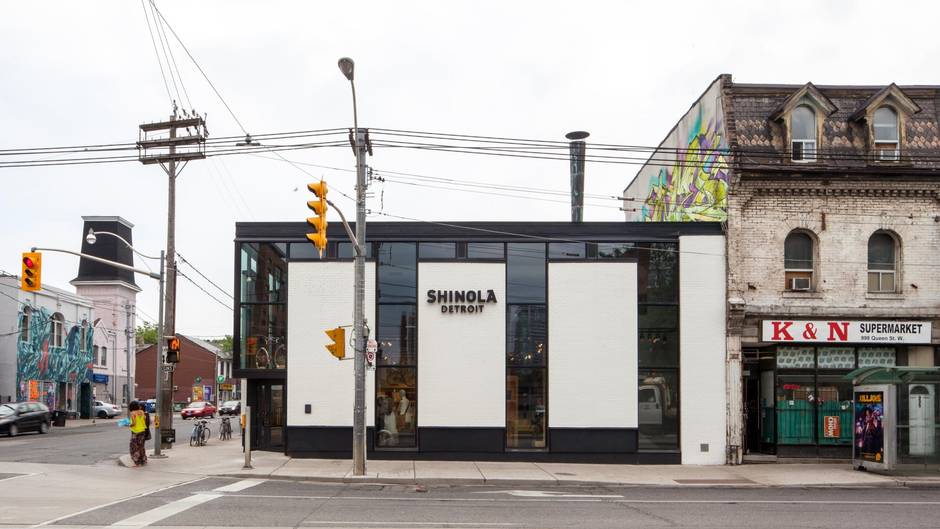
The width and height of the screenshot is (940, 529). What are the coordinates of `air conditioner unit` in the screenshot? It's located at (800, 285).